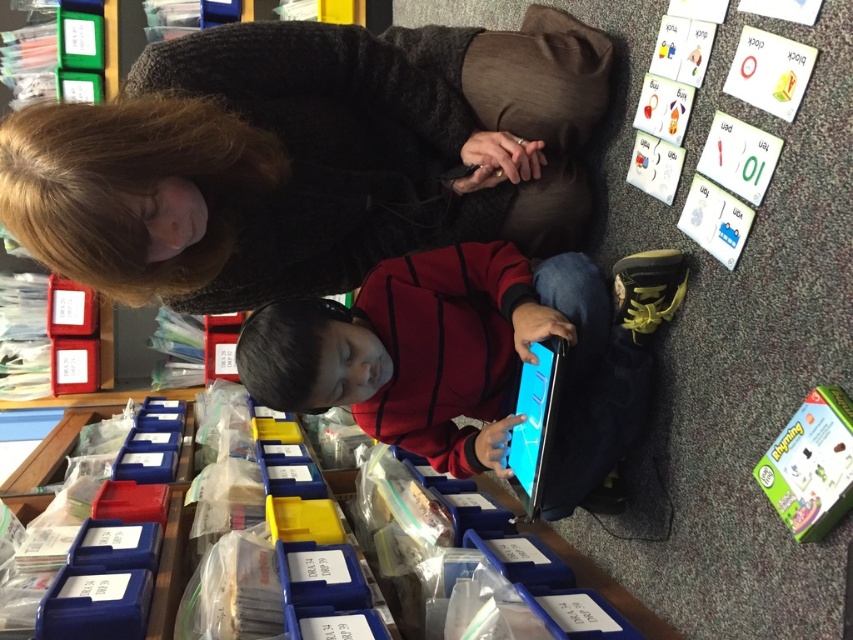
Looking at this image, you are a student in the classroom and you want to hand in your assignment to the teacher. The teacher is wearing the dark gray sweater at upper center and you are holding the matte black tablet at center. Which object is taller and needs to look up to see the other?

The dark gray sweater at upper center is much taller than the matte black tablet at center, so you would need to look up to see the dark gray sweater at upper center from the matte black tablet at center.

You are a teacher in the classroom and need to locate the smooth black tablet at center. Where exactly is it positioned?

The smooth black tablet at center is positioned at point coordinates of 0.559 on the x axis and 0.553 on the y axis.

You are a student in the classroom and you see the point at coordinates (311,156). Which object is that point located on?

The point at coordinates (311,156) is located on the dark gray sweater at upper center.